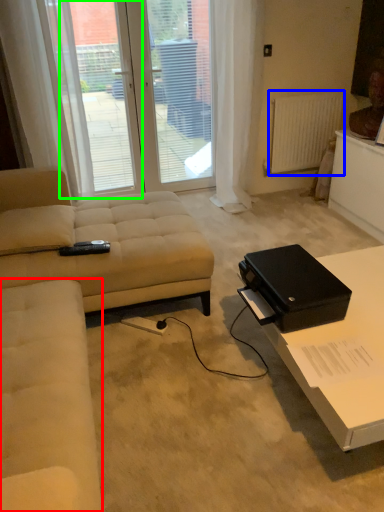
Question: Which is farther away from couch (highlighted by a red box)? radiator (highlighted by a blue box) or window screen (highlighted by a green box)?

Choices:
 (A) radiator
 (B) window screen

Answer: (A)